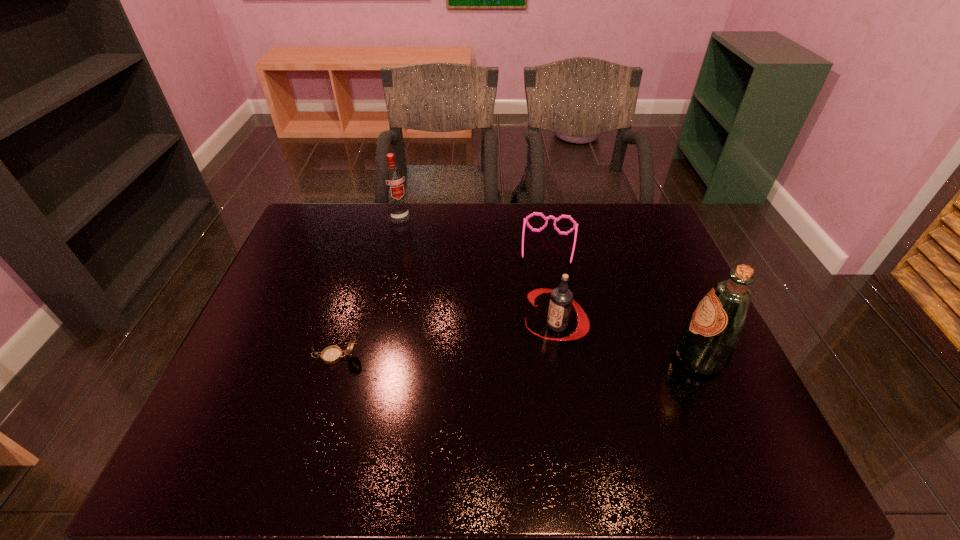
This screenshot has height=540, width=960. In order to click on free spot between the tallest object and the compass in this screenshot , I will do `click(517, 357)`.

Locate an element on the screen. The image size is (960, 540). free space between the second farthest object and the vodka is located at coordinates (474, 232).

You are a GUI agent. You are given a task and a screenshot of the screen. Output one action in this format:
    pyautogui.click(x=<x>, y=<y>)
    Task: Click on the blank region between the fourth nearest object and the rightmost object
    
    Given the screenshot: What is the action you would take?
    pyautogui.click(x=624, y=303)

Image resolution: width=960 pixels, height=540 pixels. I want to click on vacant space that's between the compass and the root beer, so click(446, 341).

The width and height of the screenshot is (960, 540). In order to click on free space between the third tallest object and the vodka in this screenshot , I will do `click(477, 271)`.

Where is `vacant space that's between the compass and the farthest object`? The image size is (960, 540). vacant space that's between the compass and the farthest object is located at coordinates (368, 287).

In order to click on free space between the second tallest object and the tallest object in this screenshot , I will do `click(549, 288)`.

Identify the location of empty space between the tallest object and the compass. (517, 357).

The image size is (960, 540). Identify the location of vacant area between the compass and the tallest object. (517, 357).

Point out which object is positioned as the fourth nearest to the spectacles. Please provide its 2D coordinates. Your answer should be formatted as a tuple, i.e. [(x, y)], where the tuple contains the x and y coordinates of a point satisfying the conditions above.

[(332, 354)]